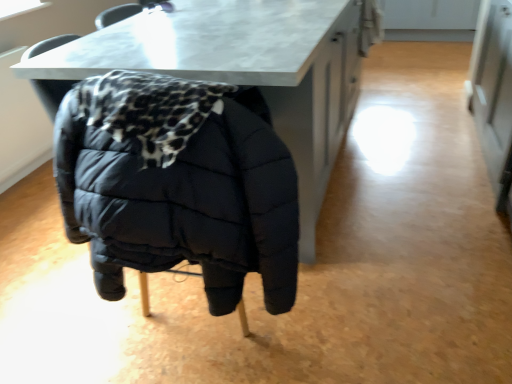
This screenshot has width=512, height=384. What do you see at coordinates (247, 69) in the screenshot?
I see `matte white marble table at center` at bounding box center [247, 69].

Where is `matte white marble table at center`? The width and height of the screenshot is (512, 384). matte white marble table at center is located at coordinates (247, 69).

What is the approximate height of matte white marble table at center?

matte white marble table at center is 36.41 inches in height.

What do you see at coordinates (178, 184) in the screenshot? I see `matte black puffer jacket at center` at bounding box center [178, 184].

Where is `matte black puffer jacket at center`? This screenshot has width=512, height=384. matte black puffer jacket at center is located at coordinates (178, 184).

Find the location of `matte white marble table at center`. matte white marble table at center is located at coordinates (247, 69).

Which is more to the right, matte white marble table at center or matte black puffer jacket at center?

From the viewer's perspective, matte white marble table at center appears more on the right side.

Who is more distant, matte white marble table at center or matte black puffer jacket at center?

matte white marble table at center is further from the camera.

Does point (350, 0) come behind point (293, 285)?

Yes, it is behind point (293, 285).

From the picture: From the image's perspective, which one is positioned higher, matte white marble table at center or matte black puffer jacket at center?

matte white marble table at center appears higher in the image.

From a real-world perspective, relative to matte black puffer jacket at center, is matte white marble table at center vertically above or below?

From a real-world perspective, matte white marble table at center is physically below matte black puffer jacket at center.

Is matte white marble table at center wider or thinner than matte black puffer jacket at center?

In the image, matte white marble table at center appears to be wider than matte black puffer jacket at center.

Between matte white marble table at center and matte black puffer jacket at center, which one has more height?

Standing taller between the two is matte black puffer jacket at center.

Between matte white marble table at center and matte black puffer jacket at center, which one has smaller size?

With smaller size is matte black puffer jacket at center.

Is matte white marble table at center not within matte black puffer jacket at center?

matte white marble table at center lies outside matte black puffer jacket at center's area.

Is matte white marble table at center not close to matte black puffer jacket at center?

They are positioned close to each other.

Is matte white marble table at center positioned with its back to matte black puffer jacket at center?

No, matte black puffer jacket at center is not at the back of matte white marble table at center.

Identify the location of jacket below the matte white marble table at center (from the image's perspective). (178, 184).

Considering the relative positions of matte black puffer jacket at center and matte white marble table at center in the image provided, is matte black puffer jacket at center to the left of matte white marble table at center from the viewer's perspective?

Yes, matte black puffer jacket at center is to the left of matte white marble table at center.

Is matte black puffer jacket at center positioned in front of matte white marble table at center?

Yes, the depth of matte black puffer jacket at center is less than that of matte white marble table at center.

Which point is more distant from viewer, [124,113] or [313,24]?

Positioned behind is point [313,24].

From the image's perspective, is matte black puffer jacket at center below matte white marble table at center?

Yes, from the image's perspective, matte black puffer jacket at center is below matte white marble table at center.

From a real-world perspective, who is located higher, matte black puffer jacket at center or matte white marble table at center?

matte black puffer jacket at center is physically above.

Is matte black puffer jacket at center wider than matte white marble table at center?

No, matte black puffer jacket at center is not wider than matte white marble table at center.

Who is shorter, matte black puffer jacket at center or matte white marble table at center?

With less height is matte white marble table at center.

Does matte black puffer jacket at center have a smaller size compared to matte white marble table at center?

Indeed, matte black puffer jacket at center has a smaller size compared to matte white marble table at center.

From the picture: Do you think matte black puffer jacket at center is within matte white marble table at center, or outside of it?

matte black puffer jacket at center lies within the bounds of matte white marble table at center.

Are matte black puffer jacket at center and matte white marble table at center located far from each other?

No, matte black puffer jacket at center is in close proximity to matte white marble table at center.

Is matte black puffer jacket at center oriented towards matte white marble table at center?

Yes, matte black puffer jacket at center is turned towards matte white marble table at center.

Can you tell me how much matte black puffer jacket at center and matte white marble table at center differ in facing direction?

There is a 89.2-degree angle between the facing directions of matte black puffer jacket at center and matte white marble table at center.

How much distance is there between matte black puffer jacket at center and matte white marble table at center?

The distance of matte black puffer jacket at center from matte white marble table at center is 18.99 inches.

Locate an element on the screen. The height and width of the screenshot is (384, 512). jacket above the matte white marble table at center (from a real-world perspective) is located at coordinates (178, 184).

Locate an element on the screen. This screenshot has height=384, width=512. jacket lying on the left of matte white marble table at center is located at coordinates (178, 184).

Where is `table above the matte black puffer jacket at center (from the image's perspective)`? table above the matte black puffer jacket at center (from the image's perspective) is located at coordinates (247, 69).